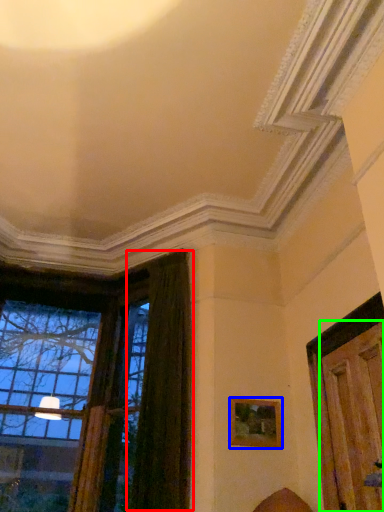
Question: Considering the real-world distances, which object is farthest from curtain (highlighted by a red box)? picture frame (highlighted by a blue box) or door (highlighted by a green box)?

Choices:
 (A) picture frame
 (B) door

Answer: (B)